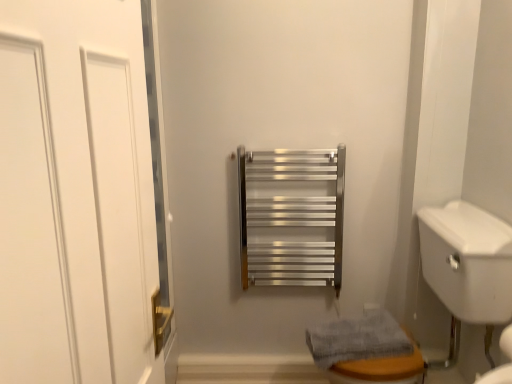
Question: Is white matte door at left outside of white glossy sink at lower right?

Choices:
 (A) yes
 (B) no

Answer: (A)

Question: Is white matte door at left oriented away from white glossy sink at lower right?

Choices:
 (A) no
 (B) yes

Answer: (A)

Question: Can you confirm if white matte door at left is thinner than white glossy sink at lower right?

Choices:
 (A) yes
 (B) no

Answer: (A)

Question: Can you confirm if white matte door at left is shorter than white glossy sink at lower right?

Choices:
 (A) yes
 (B) no

Answer: (A)

Question: From the image's perspective, does white matte door at left appear lower than white glossy sink at lower right?

Choices:
 (A) yes
 (B) no

Answer: (B)

Question: Looking at their shapes, would you say white glossy sink at lower right is wider or thinner than gray textured towel at lower right?

Choices:
 (A) thin
 (B) wide

Answer: (B)

Question: Considering their positions, is white glossy sink at lower right located in front of or behind gray textured towel at lower right?

Choices:
 (A) front
 (B) behind

Answer: (A)

Question: From the image's perspective, is white glossy sink at lower right above or below gray textured towel at lower right?

Choices:
 (A) below
 (B) above

Answer: (B)

Question: Which is correct: white glossy sink at lower right is inside gray textured towel at lower right, or outside of it?

Choices:
 (A) inside
 (B) outside

Answer: (B)

Question: In terms of height, does gray textured towel at lower right look taller or shorter compared to white matte door at left?

Choices:
 (A) tall
 (B) short

Answer: (B)

Question: Considering their positions, is gray textured towel at lower right located in front of or behind white matte door at left?

Choices:
 (A) behind
 (B) front

Answer: (A)

Question: Would you say gray textured towel at lower right is to the left or to the right of white matte door at left in the picture?

Choices:
 (A) right
 (B) left

Answer: (A)

Question: From a real-world perspective, is gray textured towel at lower right positioned above or below white matte door at left?

Choices:
 (A) above
 (B) below

Answer: (B)

Question: Is point (87, 21) closer or farther from the camera than point (343, 339)?

Choices:
 (A) closer
 (B) farther

Answer: (A)

Question: From their relative heights in the image, would you say white matte door at left is taller or shorter than gray textured towel at lower right?

Choices:
 (A) short
 (B) tall

Answer: (B)